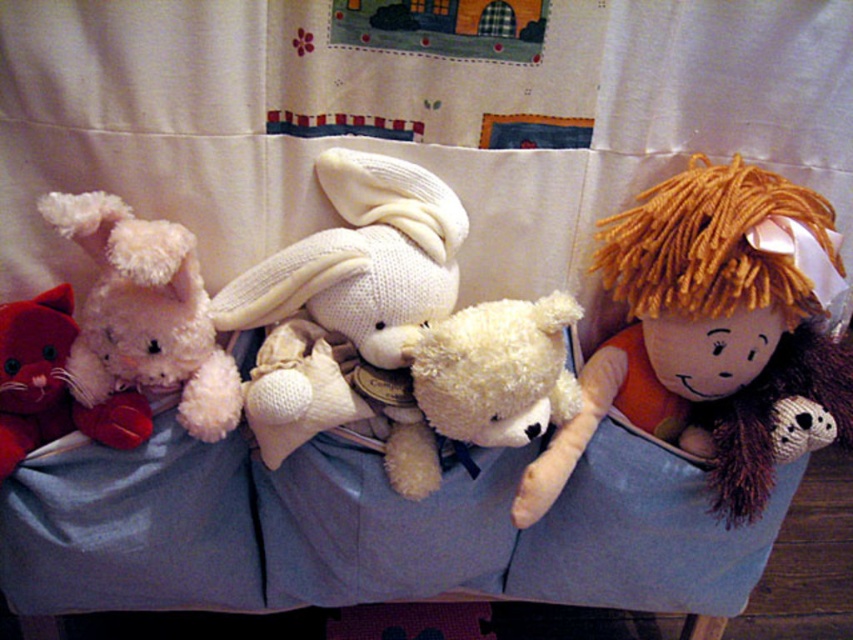
You are looking at the image of a cozy bed setup with various stuffed toys and a doll. The toys include a pink plush rabbit on the left, a cream teddy bear in the center, a smaller cream teddy bear next to it, and a doll with orange. Where is the knitted white rabbit at center located in terms of its 2D coordinates?

The knitted white rabbit at center is located at the 2D coordinates point (x=347, y=304).

You are a child trying to find your yarn doll at right. You see the fluffy white teddy bear at left. Where would you look relative to the teddy bear?

The yarn doll at right is positioned under the fluffy white teddy bear at left, so you should look underneath the teddy bear to find it.

You are a child trying to reach your toys. You see the yarn doll at right and the velvet red cat at left. Which toy is higher up?

The yarn doll at right is higher up because it is positioned above the velvet red cat at left.